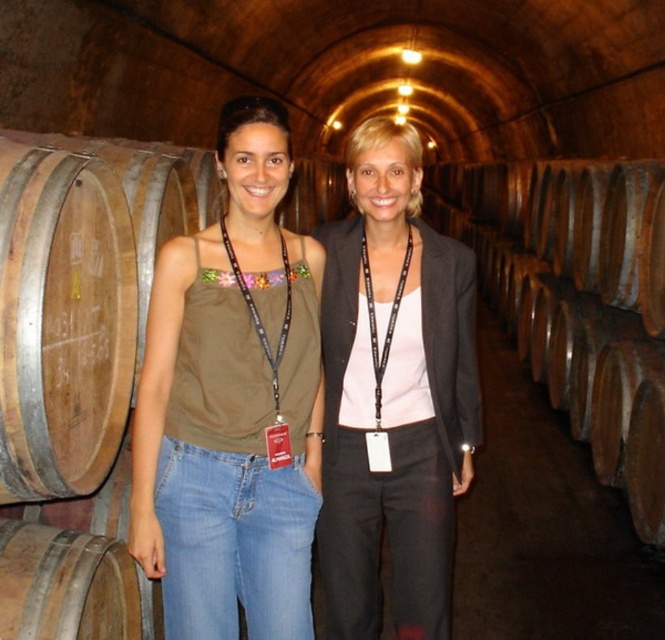
You are a photographer in the wine cellar and want to capture both the matte brown tank top at center and the matte black blazer at center in a single frame. Since the lighting is dim, you need to adjust your camera settings. However, you also want to ensure that both items are visible and properly framed. Which item should you position closer to the light source to ensure better visibility?

The matte brown tank top at center should be positioned closer to the light source because it is to the left of the matte black blazer at center, so moving it closer would help balance the lighting between both items while keeping them in frame.